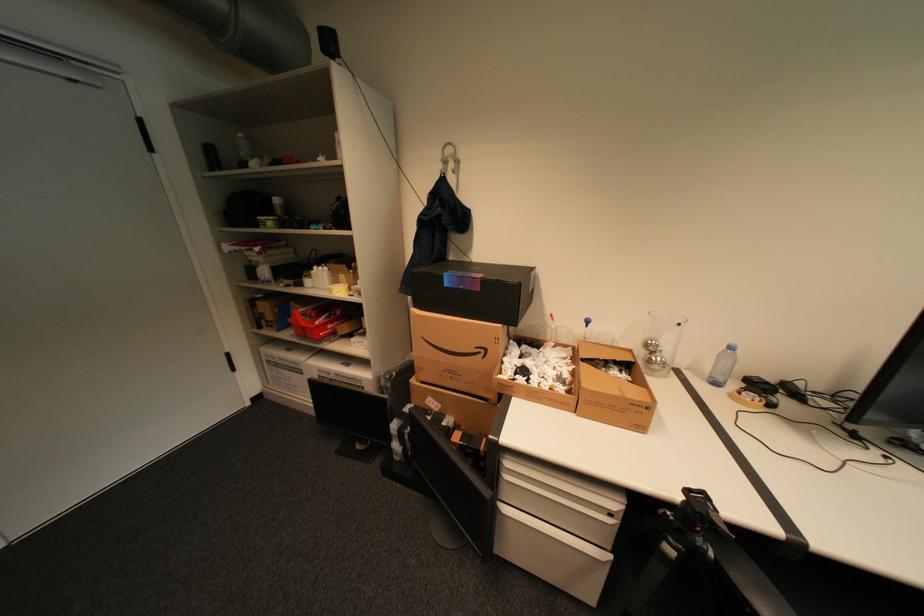
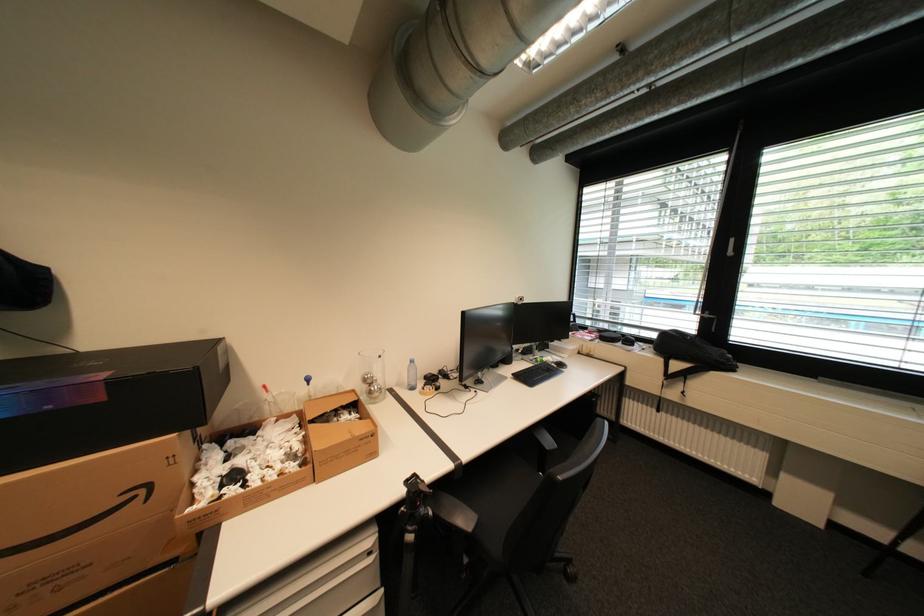
Where in the second image is the point corresponding to pixel 639 405 from the first image?

(370, 440)